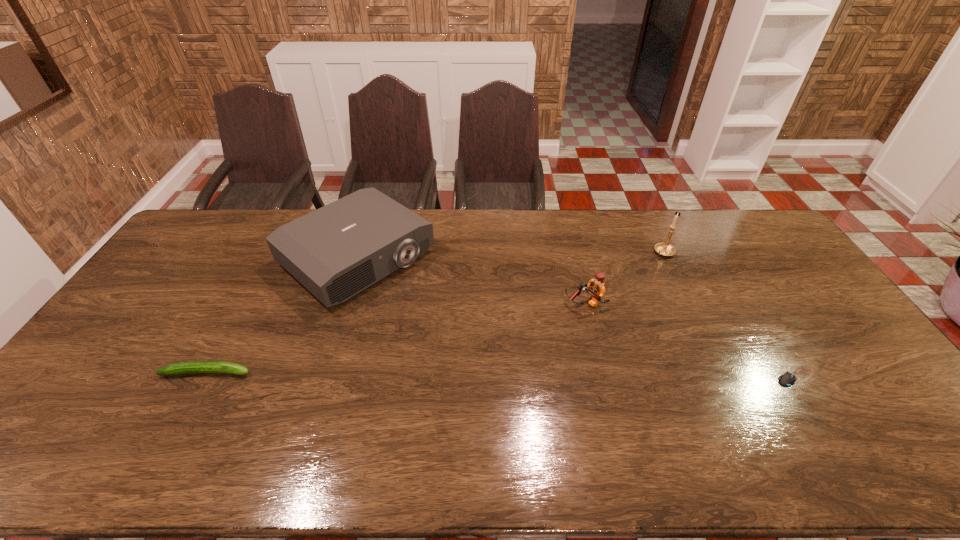
The width and height of the screenshot is (960, 540). What are the coordinates of `free space at the far edge` in the screenshot? It's located at (618, 238).

I want to click on free space at the near edge of the desktop, so click(x=448, y=426).

Locate an element on the screen. vacant space at the left edge of the desktop is located at coordinates (126, 326).

Find the location of `vacant space at the right edge`. vacant space at the right edge is located at coordinates (831, 308).

In the image, there is a desktop. Find the location of `free space at the far left corner`. free space at the far left corner is located at coordinates coord(190,246).

The width and height of the screenshot is (960, 540). In order to click on vacant space at the near left corner of the desktop in this screenshot , I will do `click(108, 412)`.

Find the location of a particular element. The width and height of the screenshot is (960, 540). vacant space at the near right corner is located at coordinates (872, 403).

Identify the location of vacant space that's between the second object from right to left and the zucchini. [436, 312].

The image size is (960, 540). I want to click on free point between the rightmost object and the fourth object from left to right, so click(731, 315).

Where is `vacant area that lies between the fourth tallest object and the candle holder`? vacant area that lies between the fourth tallest object and the candle holder is located at coordinates (436, 312).